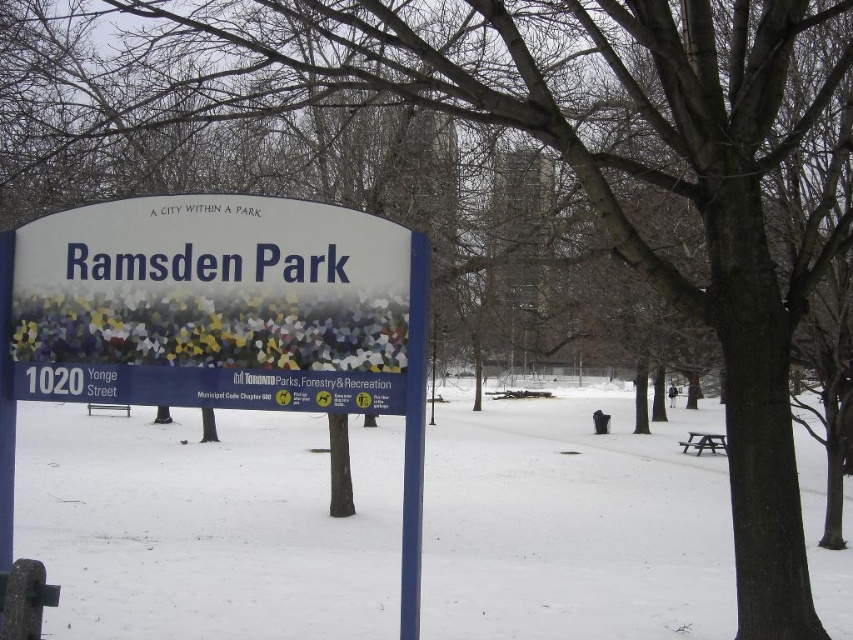
Question: Considering the relative positions of blue plastic sign at center and white plastic sign at center in the image provided, where is blue plastic sign at center located with respect to white plastic sign at center?

Choices:
 (A) left
 (B) right

Answer: (B)

Question: Which object is positioned farthest from the white powdery snow at center?

Choices:
 (A) white plastic sign at center
 (B) blue plastic sign at center

Answer: (B)

Question: Considering the real-world distances, which object is closest to the white plastic sign at center?

Choices:
 (A) white powdery snow at center
 (B) blue plastic sign at center

Answer: (B)

Question: Which point appears closest to the camera in this image?

Choices:
 (A) (352, 305)
 (B) (212, 240)

Answer: (A)

Question: Does white powdery snow at center have a larger size compared to white plastic sign at center?

Choices:
 (A) no
 (B) yes

Answer: (B)

Question: Does blue plastic sign at center have a smaller size compared to white plastic sign at center?

Choices:
 (A) yes
 (B) no

Answer: (B)